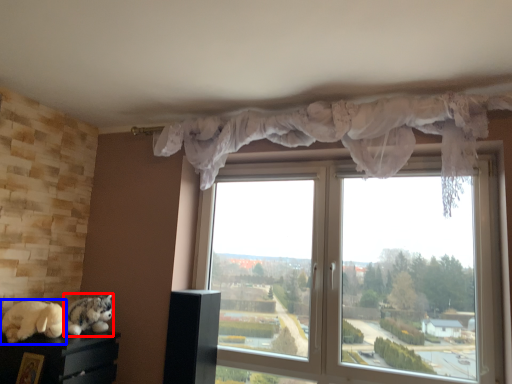
Question: Which of the following is the farthest to the observer, cat (highlighted by a red box) or animal (highlighted by a blue box)?

Choices:
 (A) cat
 (B) animal

Answer: (A)